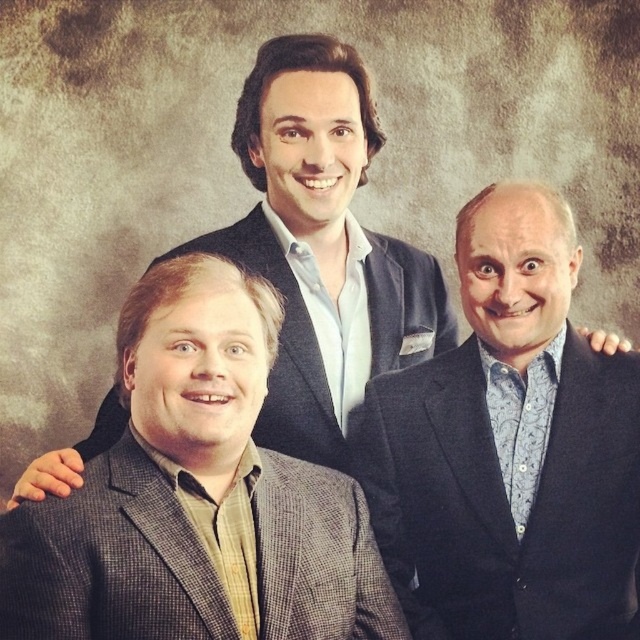
Question: Which of the following is the farthest from the observer?

Choices:
 (A) matte black suit at center
 (B) gray wool blazer at center

Answer: (B)

Question: Which point is closer to the camera taking this photo?

Choices:
 (A) (604, 378)
 (B) (324, 324)

Answer: (A)

Question: Which point appears closest to the camera in this image?

Choices:
 (A) [x=285, y=458]
 (B) [x=330, y=440]
 (C) [x=291, y=433]
 (D) [x=452, y=548]

Answer: (A)

Question: Can you confirm if gray checkered suit at lower left is wider than gray wool blazer at center?

Choices:
 (A) no
 (B) yes

Answer: (A)

Question: Is dark blue woolen suit at center below gray checkered suit at lower left?

Choices:
 (A) yes
 (B) no

Answer: (B)

Question: Does gray checkered suit at lower left have a greater width compared to gray wool blazer at center?

Choices:
 (A) no
 (B) yes

Answer: (A)